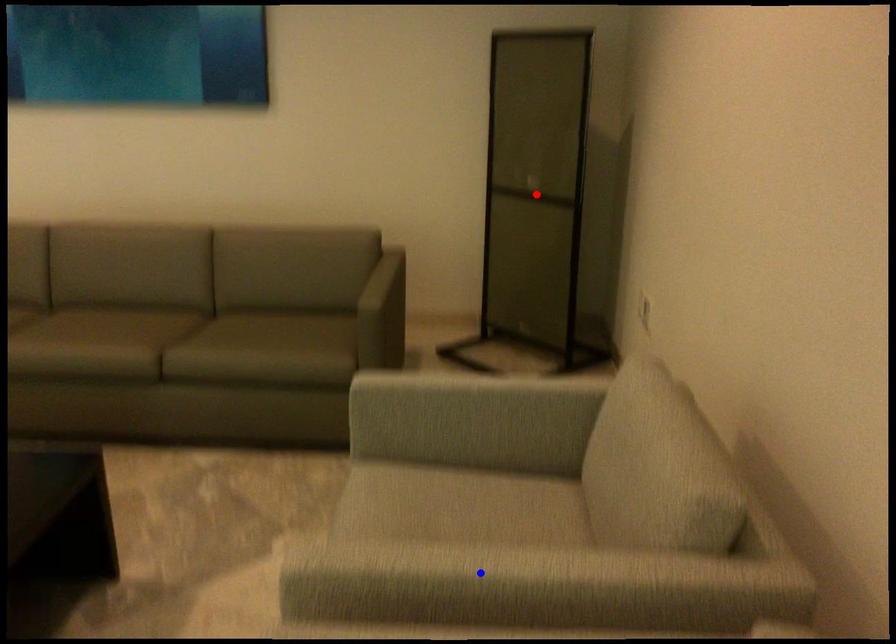
Question: Two points are marked on the image. Which point is closer to the camera?

Choices:
 (A) Blue point is closer.
 (B) Red point is closer.

Answer: (A)